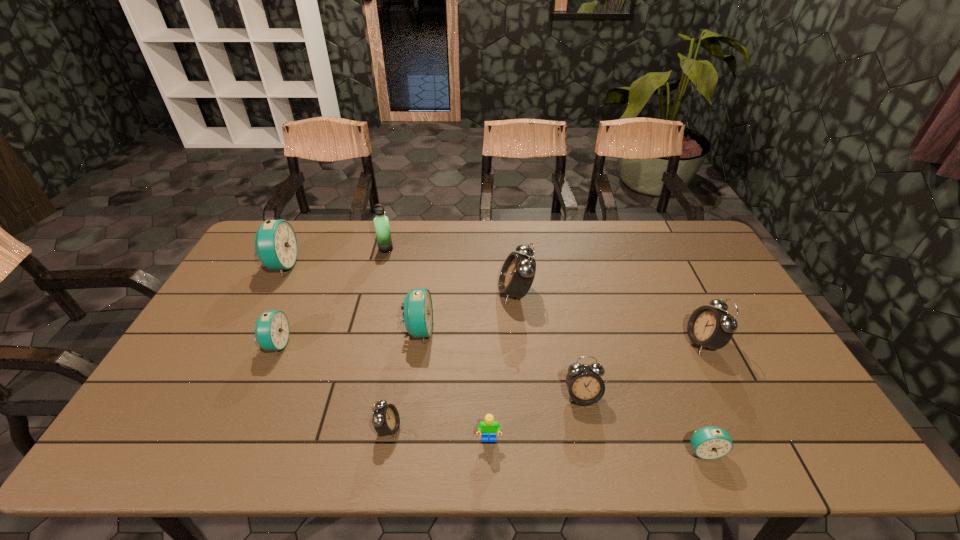
The width and height of the screenshot is (960, 540). In order to click on thermos bottle that is at the far edge in this screenshot , I will do `click(381, 222)`.

Locate an element on the screen. alarm clock that is at the far edge is located at coordinates (276, 246).

Identify the location of Lego positioned at the near edge. [x=488, y=426].

This screenshot has width=960, height=540. I want to click on object present at the left edge, so click(x=276, y=246).

You are a GUI agent. You are given a task and a screenshot of the screen. Output one action in this format:
    pyautogui.click(x=<x>, y=<y>)
    Task: Click on the object positioned at the right edge
    The image size is (960, 540).
    Given the screenshot: What is the action you would take?
    pyautogui.click(x=710, y=327)

Find the location of `object present at the far left corner`. object present at the far left corner is located at coordinates (276, 246).

Find the location of a particular element. The width and height of the screenshot is (960, 540). vacant region at the far edge of the desktop is located at coordinates (403, 239).

In the image, there is a desktop. Where is `blank space at the left edge`? blank space at the left edge is located at coordinates (260, 276).

Find the location of a particular element. The height and width of the screenshot is (540, 960). vacant region at the right edge is located at coordinates (783, 397).

Locate an element on the screen. The height and width of the screenshot is (540, 960). vacant space at the near left corner of the desktop is located at coordinates (179, 430).